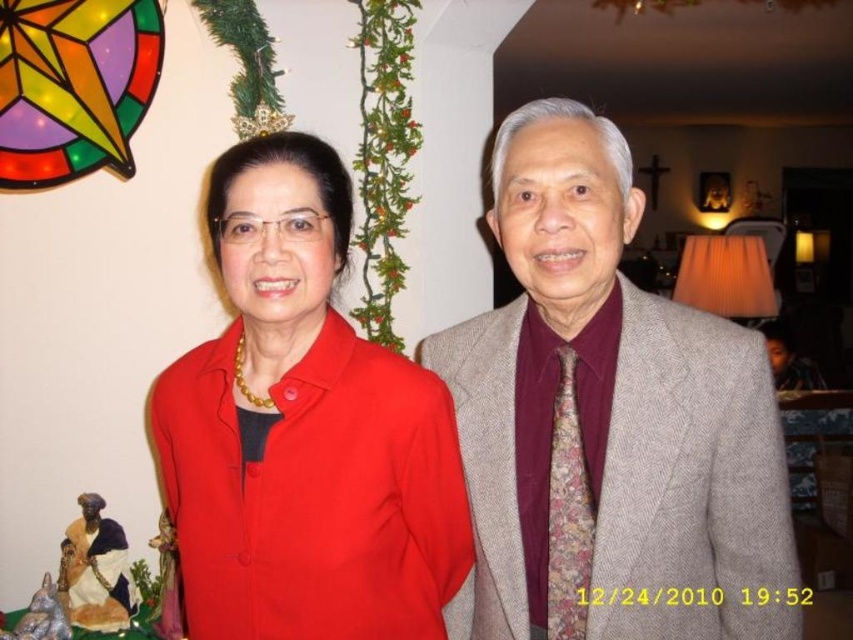
Looking at this image, you are a photographer setting up for a group photo. You need to ensure that the gray textured suit at center and the matte red shirt at center are visible in the frame. Based on their positions, which one should you focus on first to ensure both are in the frame?

The gray textured suit at center is positioned on the right side of matte red shirt at center. Since the gray textured suit is on the right, you should focus on the matte red shirt at center first to ensure both are included in the frame.

You are a photographer setting up for a group photo. You have two subjects wearing the gray textured suit at center and the matte red shirt at center. You need to ensure that the taller subject is positioned in the back row to avoid blocking the view. Which subject should be placed in the back row?

The gray textured suit at center is taller than the matte red shirt at center, so the gray textured suit at center should be placed in the back row to avoid blocking the view.

You are standing in the festive scene and want to move from the point at coordinates point (692, 568) to the point at coordinates point (419, 378). Can you walk directly towards the second point without any obstacles?

Point (692, 568) is in front of point (419, 378), so walking directly towards the second point would require moving backward, which might not be possible without obstacles depending on the space. However, since the scene is festive with decorations, there could be obstacles like the Christmas garland or the stained glass star. But according to the description, there is no mention of obstacles between them, so it might be possible.